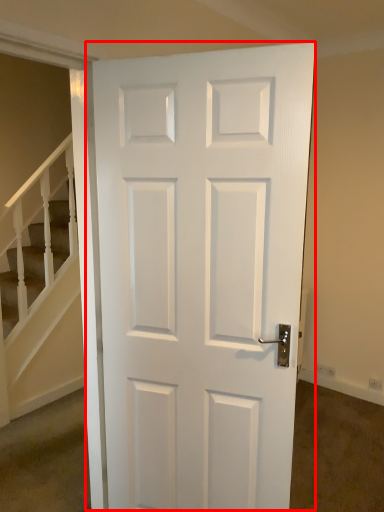
Question: In this image, where is door (annotated by the red box) located relative to stairwell?

Choices:
 (A) right
 (B) left

Answer: (A)